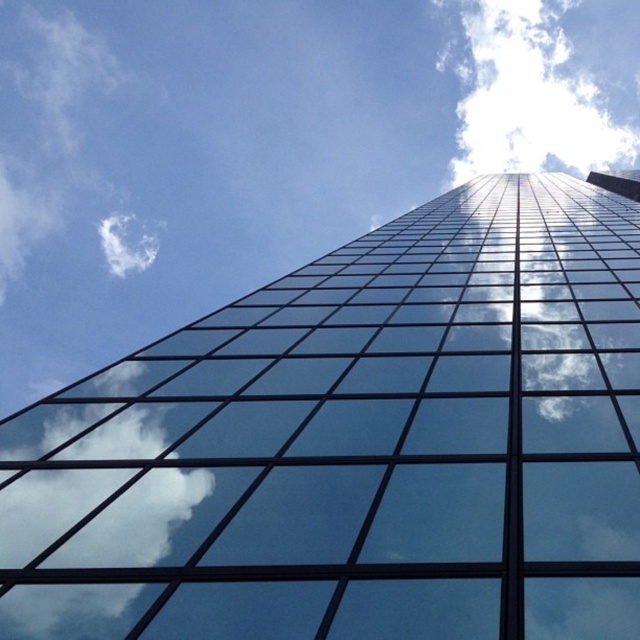
Question: Does transparent glass building at center lie behind white fluffy cloud at upper left?

Choices:
 (A) no
 (B) yes

Answer: (A)

Question: Which of the following is the farthest from the observer?

Choices:
 (A) (118, 216)
 (B) (516, 124)
 (C) (506, 419)

Answer: (B)

Question: Does transparent glass building at center have a greater width compared to white fluffy cloud at upper left?

Choices:
 (A) no
 (B) yes

Answer: (A)

Question: Which point is farther to the camera?

Choices:
 (A) (548, 76)
 (B) (125, 269)

Answer: (B)

Question: Which point is farther from the camera taking this photo?

Choices:
 (A) [128, 236]
 (B) [448, 52]

Answer: (A)

Question: Does transparent glass building at center appear over white fluffy cloud at upper center?

Choices:
 (A) yes
 (B) no

Answer: (B)